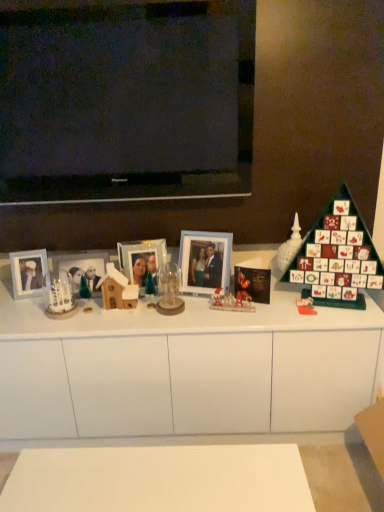
Find the location of `free space to the right of matte plastic toy at right, arranged as the first toy when viewed from the right`. free space to the right of matte plastic toy at right, arranged as the first toy when viewed from the right is located at coordinates (343, 311).